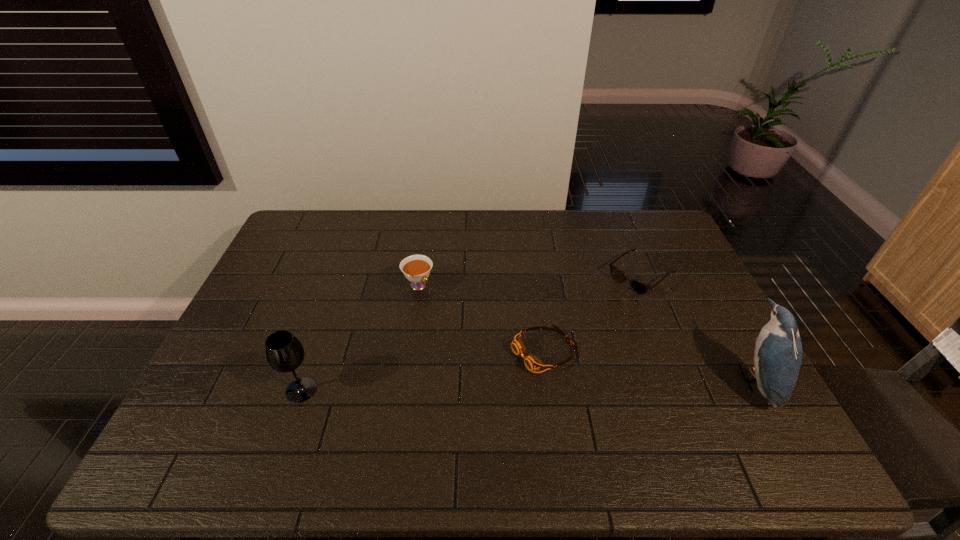
The height and width of the screenshot is (540, 960). Find the location of `vacant spot on the desktop that is between the leftmost object and the rightmost object and is positioned on the front lenses of the sunglasses`. vacant spot on the desktop that is between the leftmost object and the rightmost object and is positioned on the front lenses of the sunglasses is located at coordinates (501, 386).

Find the location of `vacant space on the desktop that is between the fourth shortest object and the rightmost object and is positioned on the side of the third tallest object with the handle`. vacant space on the desktop that is between the fourth shortest object and the rightmost object and is positioned on the side of the third tallest object with the handle is located at coordinates (510, 386).

This screenshot has height=540, width=960. Identify the location of free space on the desktop that is between the wineglass and the rightmost object and is positioned with the lenses facing forward on the goggles. (471, 386).